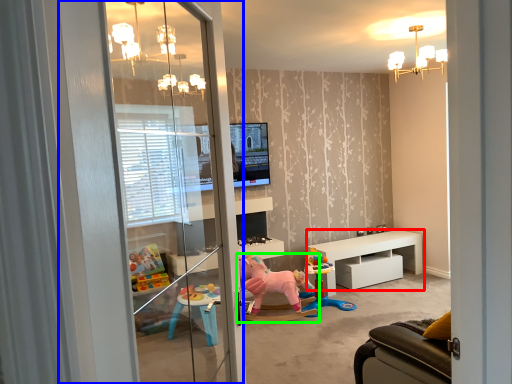
Question: Which object is the closest to the table (highlighted by a red box)? Choose among these: screen door (highlighted by a blue box) or toy (highlighted by a green box).

Choices:
 (A) screen door
 (B) toy

Answer: (B)